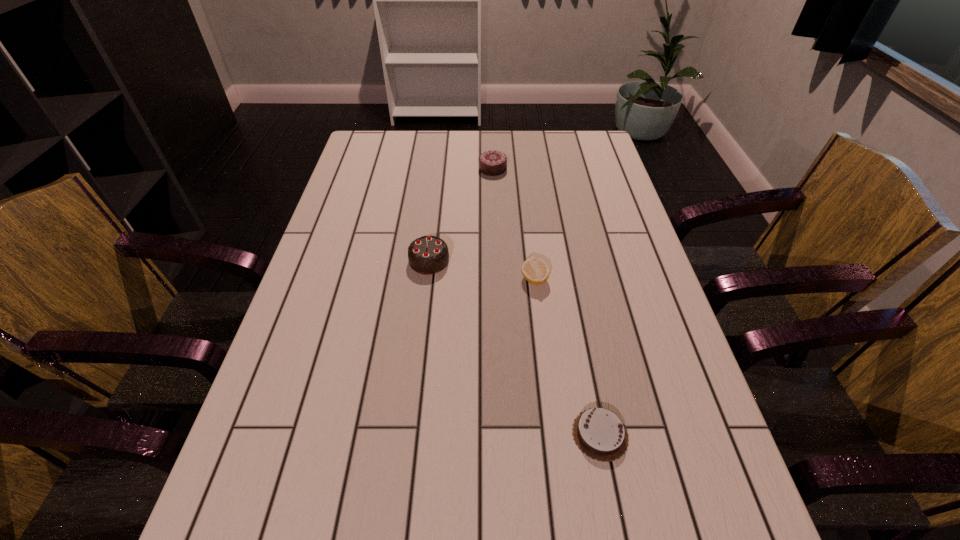
What are the coordinates of `empty space that is in between the second object from left to right and the lemon` in the screenshot? It's located at (514, 224).

Find the location of a particular element. Image resolution: width=960 pixels, height=540 pixels. empty space that is in between the second chocolate cake from left to right and the second shortest object is located at coordinates (514, 224).

Where is `empty space that is in between the leftmost object and the second chocolate cake from left to right`? The width and height of the screenshot is (960, 540). empty space that is in between the leftmost object and the second chocolate cake from left to right is located at coordinates (461, 215).

Locate an element on the screen. The height and width of the screenshot is (540, 960). unoccupied area between the rightmost object and the third object from right to left is located at coordinates 546,301.

Image resolution: width=960 pixels, height=540 pixels. Identify the location of free space between the lemon and the shortest object. (567, 357).

At what (x,y) coordinates should I click in order to perform the action: click on unoccupied position between the second nearest chocolate cake and the farthest chocolate cake. Please return your answer as a coordinate pair (x, y). This screenshot has width=960, height=540. Looking at the image, I should click on (461, 215).

In order to click on vacant space that is in between the tallest object and the second shortest object in this screenshot , I will do `click(482, 270)`.

Identify the location of the second closest object to the third object from left to right. (599, 433).

At what (x,y) coordinates should I click in order to perform the action: click on object that is the third closest to the second shortest object. Please return your answer as a coordinate pair (x, y). Image resolution: width=960 pixels, height=540 pixels. Looking at the image, I should click on (492, 163).

Where is `the second closest chocolate cake to the leftmost chocolate cake`? the second closest chocolate cake to the leftmost chocolate cake is located at coordinates (599, 433).